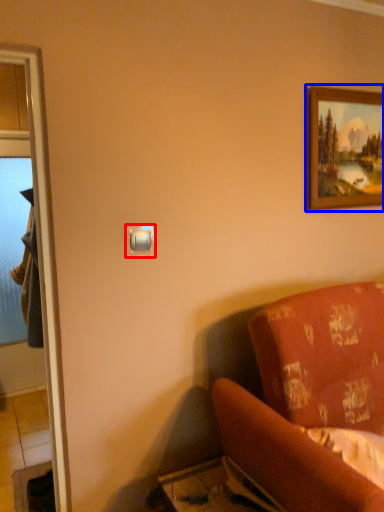
Question: Which of the following is the farthest to the observer, light switch (highlighted by a red box) or picture frame (highlighted by a blue box)?

Choices:
 (A) light switch
 (B) picture frame

Answer: (B)